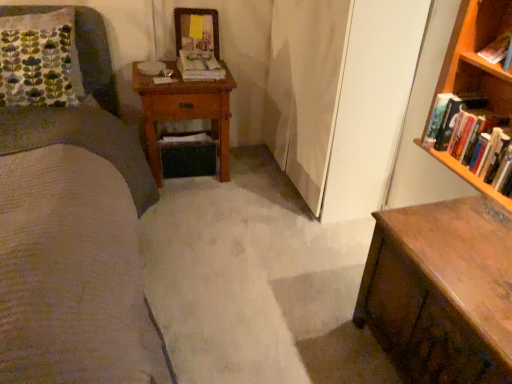
Question: Does hardcover books at right, the 3th book viewed from the top, have a greater width compared to hardcover book at upper right, the 2th book when ordered from front to back?

Choices:
 (A) yes
 (B) no

Answer: (A)

Question: Can you confirm if hardcover books at right, placed as the third book when sorted from left to right, is taller than hardcover book at upper right, which is counted as the 2th book, starting from the left?

Choices:
 (A) yes
 (B) no

Answer: (A)

Question: Does hardcover books at right, placed as the third book when sorted from left to right, contain hardcover book at upper right, positioned as the second book in bottom-to-top order?

Choices:
 (A) yes
 (B) no

Answer: (B)

Question: Is hardcover books at right, placed as the third book when sorted from left to right, aimed at hardcover book at upper right, positioned as the second book in bottom-to-top order?

Choices:
 (A) no
 (B) yes

Answer: (A)

Question: From a real-world perspective, is hardcover books at right, the 3th book viewed from the top, on top of hardcover book at upper right, which ranks as the 2th book in top-to-bottom order?

Choices:
 (A) yes
 (B) no

Answer: (B)

Question: From the image's perspective, is hardcover books at right, which appears as the first book when ordered from the bottom, positioned above or below wooden nightstand at center?

Choices:
 (A) below
 (B) above

Answer: (A)

Question: Relative to wooden nightstand at center, is hardcover books at right, which is the 3th book in back-to-front order, in front or behind?

Choices:
 (A) behind
 (B) front

Answer: (B)

Question: Is hardcover books at right, the 1th book in the front-to-back sequence, taller or shorter than wooden nightstand at center?

Choices:
 (A) tall
 (B) short

Answer: (B)

Question: From a real-world perspective, is hardcover books at right, acting as the first book starting from the right, positioned above or below wooden nightstand at center?

Choices:
 (A) below
 (B) above

Answer: (B)

Question: Is point (441, 122) positioned closer to the camera than point (202, 67)?

Choices:
 (A) closer
 (B) farther

Answer: (A)

Question: Visually, is hardcover books at right, acting as the first book starting from the right, positioned to the left or to the right of white paper book at center, marked as the 1th book in a left-to-right arrangement?

Choices:
 (A) right
 (B) left

Answer: (A)

Question: Relative to white paper book at center, placed as the 1th book when sorted from top to bottom, is hardcover books at right, which appears as the first book when ordered from the bottom, in front or behind?

Choices:
 (A) front
 (B) behind

Answer: (A)

Question: In terms of size, does hardcover books at right, the 3th book viewed from the top, appear bigger or smaller than white paper book at center, the 3th book ordered from the bottom?

Choices:
 (A) big
 (B) small

Answer: (A)

Question: From their relative heights in the image, would you say wooden chest of drawers at lower right is taller or shorter than hardcover book at upper right, which appears as the second book when viewed from the right?

Choices:
 (A) tall
 (B) short

Answer: (A)

Question: From a real-world perspective, is wooden chest of drawers at lower right physically located above or below hardcover book at upper right, the 2th book when ordered from front to back?

Choices:
 (A) below
 (B) above

Answer: (A)